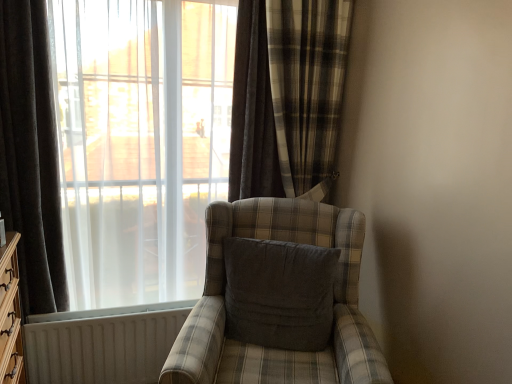
Question: Does transparent fabric at left have a larger size compared to dark grey velvet curtain at left, the first curtain viewed from the left?

Choices:
 (A) yes
 (B) no

Answer: (A)

Question: Is transparent fabric at left further to the viewer compared to dark grey velvet curtain at left, placed as the second curtain when sorted from right to left?

Choices:
 (A) no
 (B) yes

Answer: (B)

Question: From the image's perspective, is transparent fabric at left over dark grey velvet curtain at left, placed as the second curtain when sorted from right to left?

Choices:
 (A) yes
 (B) no

Answer: (A)

Question: Considering the relative positions of transparent fabric at left and dark grey velvet curtain at left, the first curtain viewed from the left, in the image provided, is transparent fabric at left to the left of dark grey velvet curtain at left, the first curtain viewed from the left, from the viewer's perspective?

Choices:
 (A) no
 (B) yes

Answer: (A)

Question: Does transparent fabric at left contain dark grey velvet curtain at left, placed as the second curtain when sorted from right to left?

Choices:
 (A) yes
 (B) no

Answer: (B)

Question: Is plaid fabric chair at center wider or thinner than plaid fabric curtain at center, the second curtain from the left?

Choices:
 (A) wide
 (B) thin

Answer: (A)

Question: Is plaid fabric chair at center taller or shorter than plaid fabric curtain at center, marked as the 1th curtain in a right-to-left arrangement?

Choices:
 (A) tall
 (B) short

Answer: (B)

Question: From a real-world perspective, is plaid fabric chair at center physically located above or below plaid fabric curtain at center, marked as the 1th curtain in a right-to-left arrangement?

Choices:
 (A) below
 (B) above

Answer: (A)

Question: Relative to plaid fabric curtain at center, marked as the 1th curtain in a right-to-left arrangement, is plaid fabric chair at center in front or behind?

Choices:
 (A) behind
 (B) front

Answer: (B)

Question: In terms of width, does white textured radiator at lower left look wider or thinner when compared to dark gray fabric pillow at center?

Choices:
 (A) wide
 (B) thin

Answer: (B)

Question: Is white textured radiator at lower left inside or outside of dark gray fabric pillow at center?

Choices:
 (A) inside
 (B) outside

Answer: (B)

Question: From the image's perspective, is white textured radiator at lower left above or below dark gray fabric pillow at center?

Choices:
 (A) above
 (B) below

Answer: (B)

Question: Considering the relative positions of white textured radiator at lower left and dark gray fabric pillow at center in the image provided, is white textured radiator at lower left to the left or to the right of dark gray fabric pillow at center?

Choices:
 (A) left
 (B) right

Answer: (A)

Question: In terms of size, does plaid fabric chair at center appear bigger or smaller than dark grey velvet curtain at left, the first curtain viewed from the left?

Choices:
 (A) small
 (B) big

Answer: (B)

Question: Considering the positions of plaid fabric chair at center and dark grey velvet curtain at left, the first curtain viewed from the left, in the image, is plaid fabric chair at center taller or shorter than dark grey velvet curtain at left, the first curtain viewed from the left,?

Choices:
 (A) short
 (B) tall

Answer: (A)